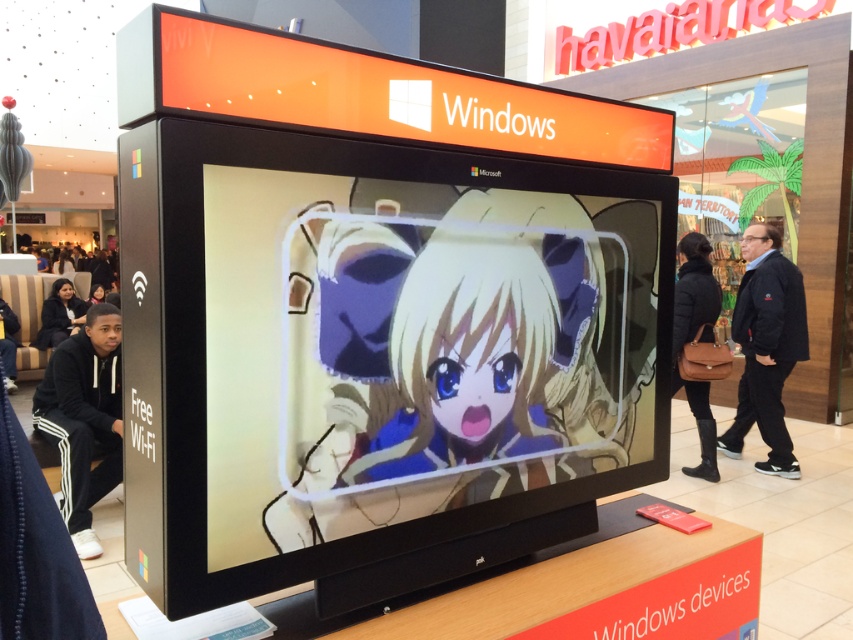
Is point (709, 269) behind point (70, 298)?

No.

Does black leather bag at right have a greater width compared to black leather jacket at lower left?

In fact, black leather bag at right might be narrower than black leather jacket at lower left.

At what (x,y) coordinates should I click in order to perform the action: click on black leather bag at right. Please return your answer as a coordinate pair (x, y). Looking at the image, I should click on (693, 337).

You are a GUI agent. You are given a task and a screenshot of the screen. Output one action in this format:
    pyautogui.click(x=<x>, y=<y>)
    Task: Click on the black leather bag at right
    The width and height of the screenshot is (853, 640).
    Given the screenshot: What is the action you would take?
    pyautogui.click(x=693, y=337)

How distant is black leather bag at right from black hoodie at lower left?

They are 6.53 meters apart.

Who is positioned more to the right, black leather bag at right or black hoodie at lower left?

Positioned to the right is black leather bag at right.

Is point (704, 456) positioned after point (7, 328)?

No, (704, 456) is closer to viewer.

You are a GUI agent. You are given a task and a screenshot of the screen. Output one action in this format:
    pyautogui.click(x=<x>, y=<y>)
    Task: Click on the black leather bag at right
    
    Given the screenshot: What is the action you would take?
    pyautogui.click(x=693, y=337)

Is black fleece pants at lower left shorter than black fabric jacket at right?

Yes, black fleece pants at lower left is shorter than black fabric jacket at right.

Measure the distance between black fleece pants at lower left and camera.

The distance of black fleece pants at lower left from camera is 3.29 meters.

The height and width of the screenshot is (640, 853). I want to click on black fleece pants at lower left, so click(84, 419).